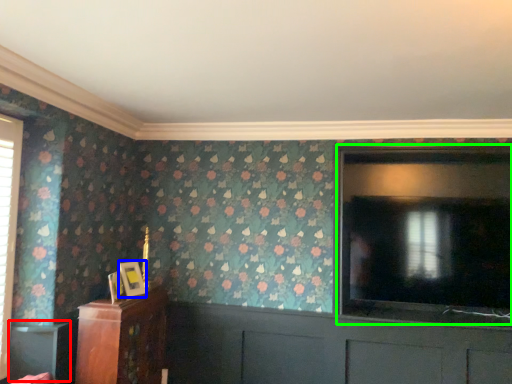
Question: Based on their relative distances, which object is nearer to table (highlighted by a red box)? Choose from picture frame (highlighted by a blue box) and screen door (highlighted by a green box).

Choices:
 (A) picture frame
 (B) screen door

Answer: (A)